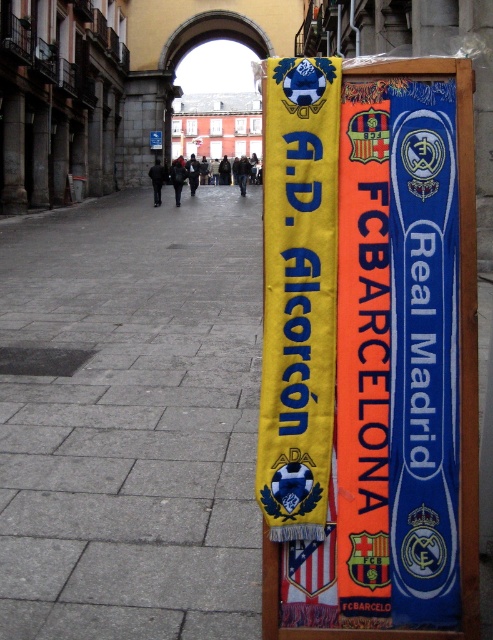
You are standing on the gray stone pavement at center. What are the coordinates of the point you are standing on?

The coordinates of the gray stone pavement at center are point (133,419).

You are standing in the plaza and want to walk towards the gray stone pavement at center and the yellow fabric banner at center. Which one will you step on first?

You will step on the gray stone pavement at center first because it is closer to you than the yellow fabric banner at center.

You are a tourist walking on the gray stone pavement at center and want to reach the yellow fabric banner at center. Which direction should you move to get there?

To reach the yellow fabric banner at center from the gray stone pavement at center, you should move to the right since the gray stone pavement is located to the left of the yellow fabric banner.